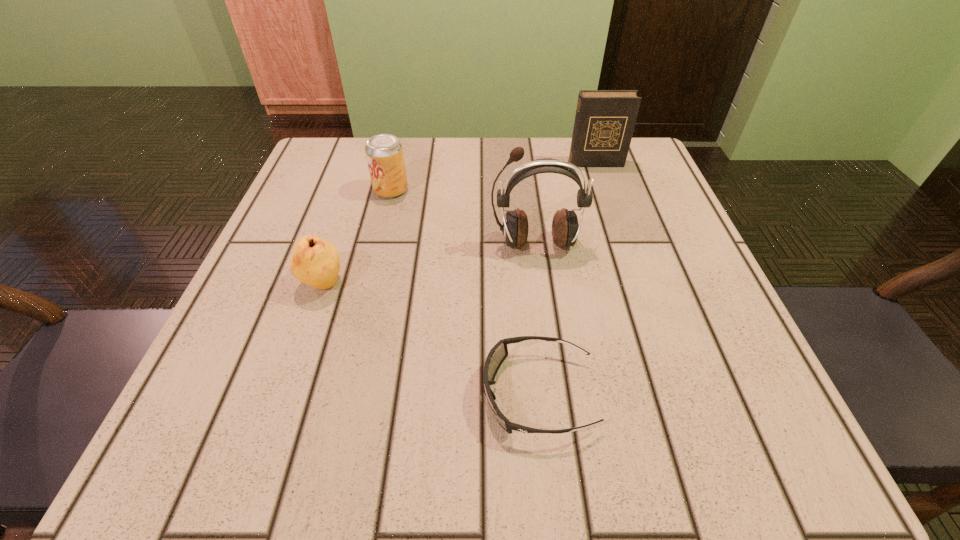
Where is `pop (soda) present at the left edge`? pop (soda) present at the left edge is located at coordinates tap(384, 152).

The height and width of the screenshot is (540, 960). Identify the location of pear located in the left edge section of the desktop. (314, 261).

Find the location of a particular element. object at the right edge is located at coordinates (604, 124).

The image size is (960, 540). I want to click on object positioned at the far left corner, so click(384, 152).

The width and height of the screenshot is (960, 540). In order to click on object that is positioned at the far right corner in this screenshot , I will do `click(604, 124)`.

This screenshot has width=960, height=540. I want to click on free space at the far edge, so click(x=500, y=163).

Find the location of a particular element. free space at the near edge of the desktop is located at coordinates (461, 414).

Locate an element on the screen. The height and width of the screenshot is (540, 960). free region at the left edge is located at coordinates (363, 201).

The height and width of the screenshot is (540, 960). In order to click on free location at the right edge of the desktop in this screenshot , I will do `click(666, 300)`.

Identify the location of free spot at the far left corner of the desktop. (318, 144).